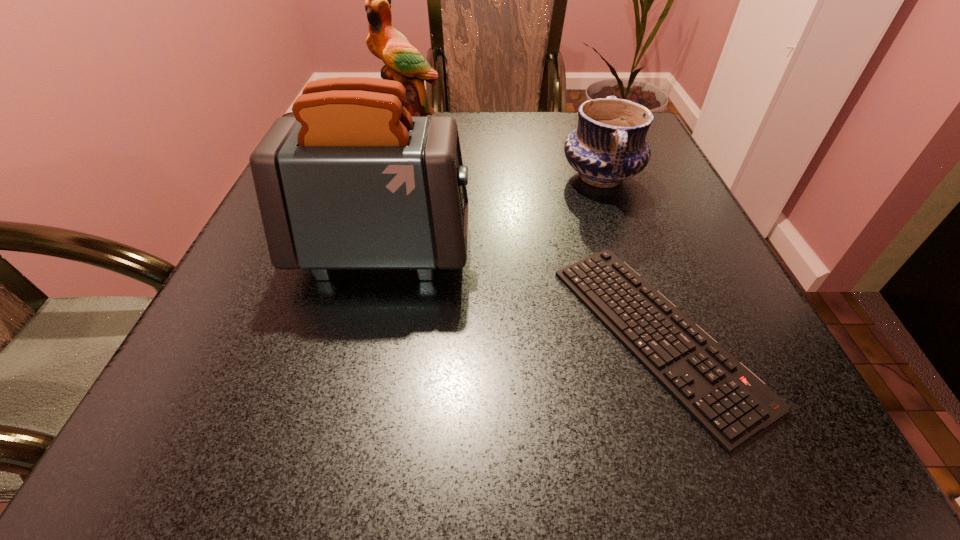
Find the location of a particular element. Image resolution: width=960 pixels, height=540 pixels. vacant area between the third tallest object and the shortest object is located at coordinates (629, 255).

Image resolution: width=960 pixels, height=540 pixels. I want to click on blank region between the shortest object and the toaster, so click(519, 292).

Where is `free point between the shortest object and the second farthest object`? Image resolution: width=960 pixels, height=540 pixels. free point between the shortest object and the second farthest object is located at coordinates (629, 255).

Where is `free space between the shortest object and the third nearest object`? free space between the shortest object and the third nearest object is located at coordinates (629, 255).

Choose which object is the nearest neighbor to the toaster. Please provide its 2D coordinates. Your answer should be formatted as a tuple, i.e. [(x, y)], where the tuple contains the x and y coordinates of a point satisfying the conditions above.

[(731, 403)]

The image size is (960, 540). In order to click on the closest object relative to the shortest object in this screenshot , I will do `click(352, 182)`.

Image resolution: width=960 pixels, height=540 pixels. I want to click on free spot that satisfies the following two spatial constraints: 1. on the front-facing side of the parrot; 2. on the left side of the third tallest object, so click(x=396, y=176).

This screenshot has height=540, width=960. I want to click on free location that satisfies the following two spatial constraints: 1. on the front-facing side of the third tallest object; 2. on the left side of the parrot, so click(x=396, y=176).

Where is `free space that satisfies the following two spatial constraints: 1. on the front-facing side of the pottery; 2. on the right side of the farthest object`? free space that satisfies the following two spatial constraints: 1. on the front-facing side of the pottery; 2. on the right side of the farthest object is located at coordinates (396, 176).

In order to click on blank area in the image that satisfies the following two spatial constraints: 1. on the front side of the pottery; 2. on the front-facing side of the toaster in this screenshot , I will do pyautogui.click(x=628, y=251).